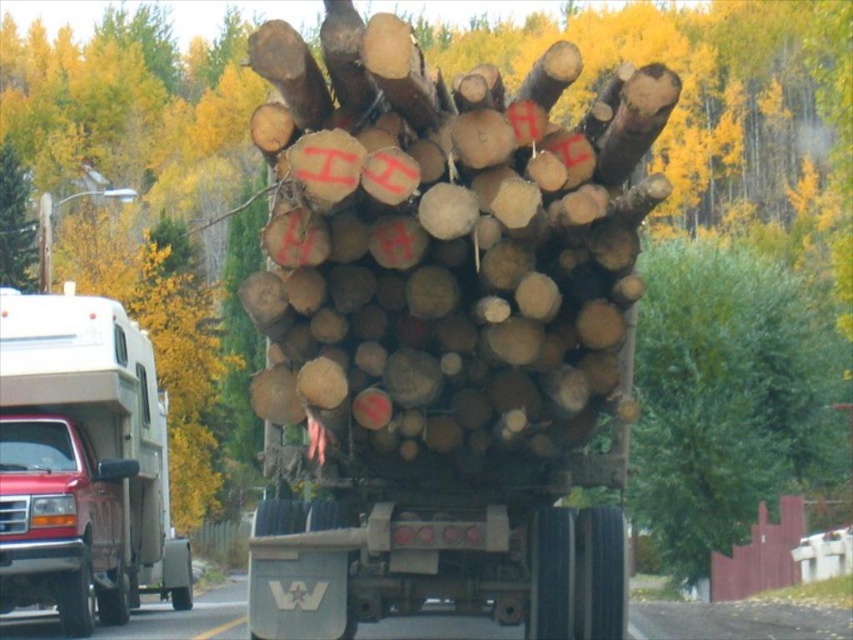
Question: Which is nearer to the matte white truck at left?

Choices:
 (A) natural wood logs at center
 (B) green leafy tree at center

Answer: (A)

Question: Which is farther from the green leafy tree at center?

Choices:
 (A) matte white truck at left
 (B) natural wood logs at center

Answer: (A)

Question: Does green leafy tree at center have a larger size compared to matte white truck at left?

Choices:
 (A) no
 (B) yes

Answer: (B)

Question: Which point is closer to the camera?

Choices:
 (A) matte white truck at left
 (B) natural wood logs at center
 (C) green leafy tree at center

Answer: (B)

Question: Is green leafy tree at center positioned behind matte white truck at left?

Choices:
 (A) no
 (B) yes

Answer: (A)

Question: Is natural wood logs at center positioned before green leafy tree at center?

Choices:
 (A) no
 (B) yes

Answer: (B)